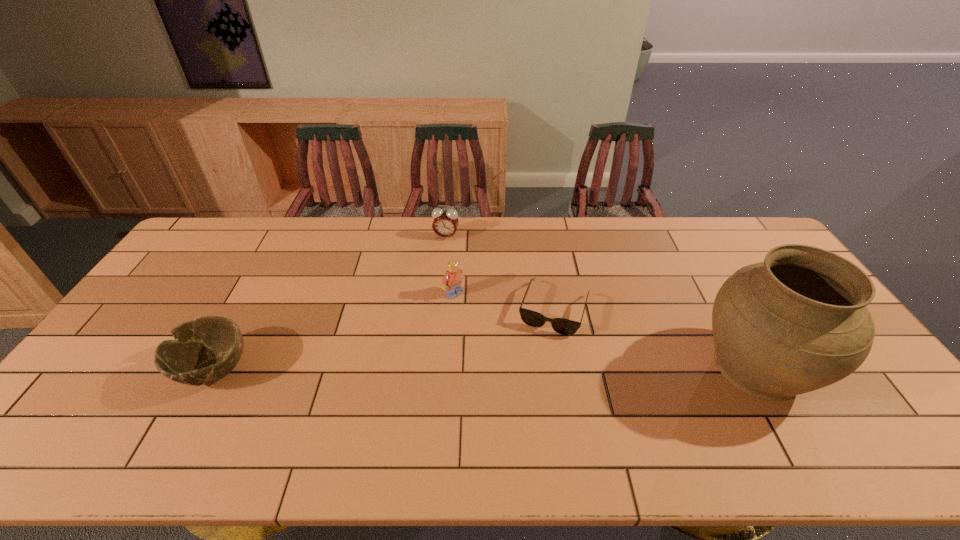
This screenshot has width=960, height=540. I want to click on vacant point located 0.090m at the front lenses of the sunglasses, so click(x=538, y=360).

I want to click on vacant region located 0.210m at the front lenses of the sunglasses, so click(526, 397).

Locate an element on the screen. Image resolution: width=960 pixels, height=540 pixels. vacant region located 0.090m at the front lenses of the sunglasses is located at coordinates (538, 360).

I want to click on vacant space located on the clock face of the farthest object, so click(435, 273).

Identify the location of free point located 0.220m on the clock face of the farthest object. (432, 283).

You are a GUI agent. You are given a task and a screenshot of the screen. Output one action in this format:
    pyautogui.click(x=<x>, y=<y>)
    Task: Click on the vacant space situated on the clock face of the farthest object
    The height and width of the screenshot is (540, 960).
    Given the screenshot: What is the action you would take?
    [432, 285]

At what (x,y) coordinates should I click in order to perform the action: click on vacant space located on the front-facing side of the Lego. Please return your answer as a coordinate pair (x, y). This screenshot has width=960, height=540. Looking at the image, I should click on (515, 342).

Locate an element on the screen. vacant space situated 0.190m on the front-facing side of the Lego is located at coordinates (505, 334).

I want to click on vacant space located 0.240m on the front-facing side of the Lego, so click(x=517, y=345).

Locate an element on the screen. The image size is (960, 540). object that is at the far edge is located at coordinates (445, 223).